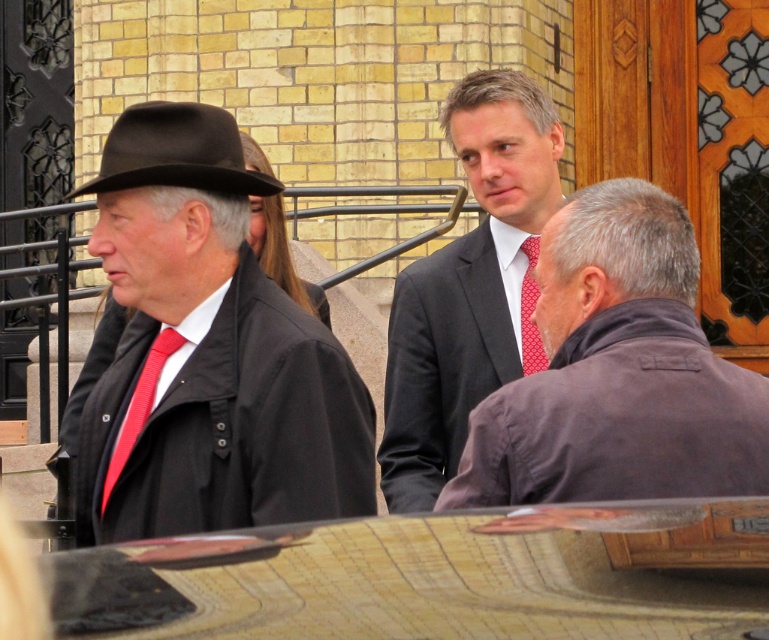
Who is taller, dark brown leather jacket at center or black felt fedora at left?

With more height is black felt fedora at left.

Who is more forward, [671,346] or [278,182]?

Point [671,346]

At what (x,y) coordinates should I click in order to perform the action: click on dark brown leather jacket at center. Please return your answer as a coordinate pair (x, y). The image size is (769, 640). Looking at the image, I should click on (618, 372).

Is the position of matte black hat at left less distant than that of black felt fedora at left?

Yes, matte black hat at left is closer to the viewer.

In order to click on matte black hat at left in this screenshot , I will do `click(207, 353)`.

The height and width of the screenshot is (640, 769). I want to click on matte black hat at left, so click(207, 353).

Between point (102, 186) and point (528, 257), which one is positioned in front?

Point (102, 186) is more forward.

Which of these two, black felt fedora at left or red dotted fabric tie at center, stands shorter?

red dotted fabric tie at center

Does point (158, 177) come farther from viewer compared to point (531, 340)?

No.

Identify the location of black felt fedora at left. (175, 150).